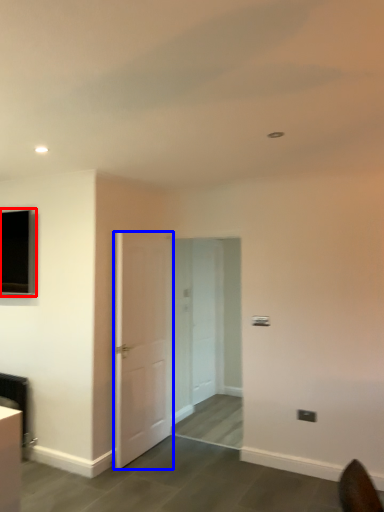
Question: Which object appears farthest to the camera in this image, window (highlighted by a red box) or door (highlighted by a blue box)?

Choices:
 (A) window
 (B) door

Answer: (A)